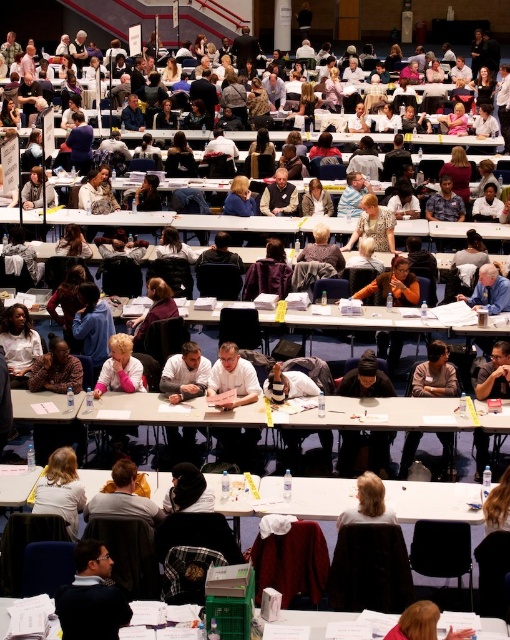
You are standing at the entrance of the conference hall and notice two people in your line of sight. One is wearing a dark blue sweater at lower left, and the other has blonde hair at center. Which person is closer to you?

The dark blue sweater at lower left is in front of blonde hair at center, so the person wearing the dark blue sweater at lower left is closer to you.

You are standing at the entrance of the conference hall and want to reach a specific point marked at coordinates point (93, 634). If your walking speed is 1.5 meters per second, how many seconds will it take you to reach that point?

The distance of point (93, 634) from camera is 8.61 meters. At a walking speed of 1.5 meters per second, it will take approximately 5.74 seconds to reach the point.

You are standing at the entrance of the conference hall and notice two individuals at the lower section of the room. One is wearing a dark blue sweater at lower left and the other has blonde hair at lower center. Based on their height, which person would likely have their head closer to the ceiling beams?

The dark blue sweater at lower left is much taller than the blonde hair at lower center, so the person wearing the dark blue sweater at lower left would have their head closer to the ceiling beams.